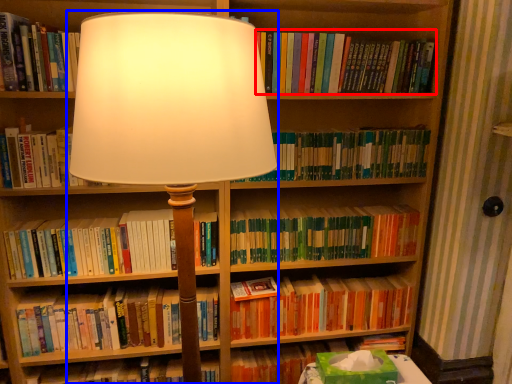
Question: Which of the following is the farthest to the observer, book (highlighted by a red box) or lamp (highlighted by a blue box)?

Choices:
 (A) book
 (B) lamp

Answer: (A)